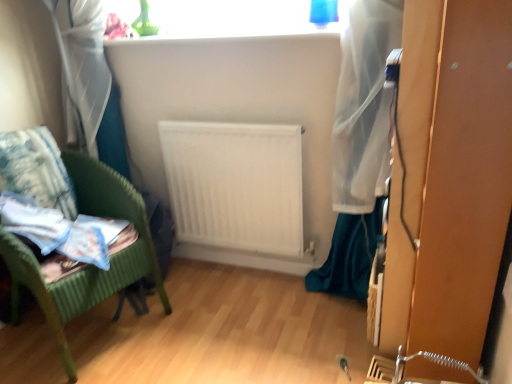
Question: Is white matte radiator at center far away from fluffy white pillow at left?

Choices:
 (A) yes
 (B) no

Answer: (B)

Question: Is white matte radiator at center shorter than fluffy white pillow at left?

Choices:
 (A) no
 (B) yes

Answer: (A)

Question: From a real-world perspective, does white matte radiator at center stand above fluffy white pillow at left?

Choices:
 (A) no
 (B) yes

Answer: (A)

Question: Can you confirm if white matte radiator at center is positioned to the left of fluffy white pillow at left?

Choices:
 (A) yes
 (B) no

Answer: (B)

Question: Considering the relative sizes of white matte radiator at center and fluffy white pillow at left in the image provided, is white matte radiator at center smaller than fluffy white pillow at left?

Choices:
 (A) no
 (B) yes

Answer: (B)

Question: Does white matte radiator at center have a greater width compared to fluffy white pillow at left?

Choices:
 (A) no
 (B) yes

Answer: (A)

Question: From the image's perspective, is white matte radiator at center beneath green wicker chair at left?

Choices:
 (A) yes
 (B) no

Answer: (B)

Question: Can you confirm if white matte radiator at center is shorter than green wicker chair at left?

Choices:
 (A) yes
 (B) no

Answer: (A)

Question: Does white matte radiator at center have a greater width compared to green wicker chair at left?

Choices:
 (A) no
 (B) yes

Answer: (A)

Question: From a real-world perspective, does white matte radiator at center stand above green wicker chair at left?

Choices:
 (A) yes
 (B) no

Answer: (A)

Question: Does white matte radiator at center appear on the right side of green wicker chair at left?

Choices:
 (A) no
 (B) yes

Answer: (B)

Question: Does white matte radiator at center lie in front of green wicker chair at left?

Choices:
 (A) yes
 (B) no

Answer: (B)

Question: Is fluffy white pillow at left bigger than green wicker chair at left?

Choices:
 (A) no
 (B) yes

Answer: (A)